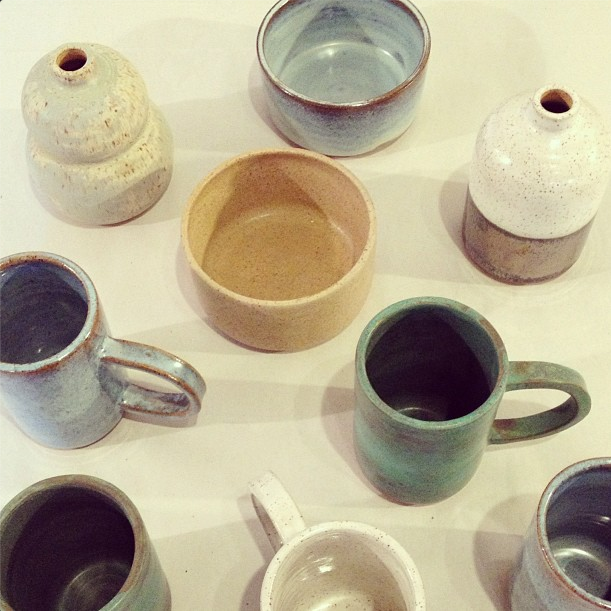
You are a GUI agent. You are given a task and a screenshot of the screen. Output one action in this format:
    pyautogui.click(x=<x>, y=<y>)
    Task: Click on the empty space next to bowl
    Image resolution: width=611 pixels, height=611 pixels.
    Given the screenshot: What is the action you would take?
    pyautogui.click(x=524, y=35)